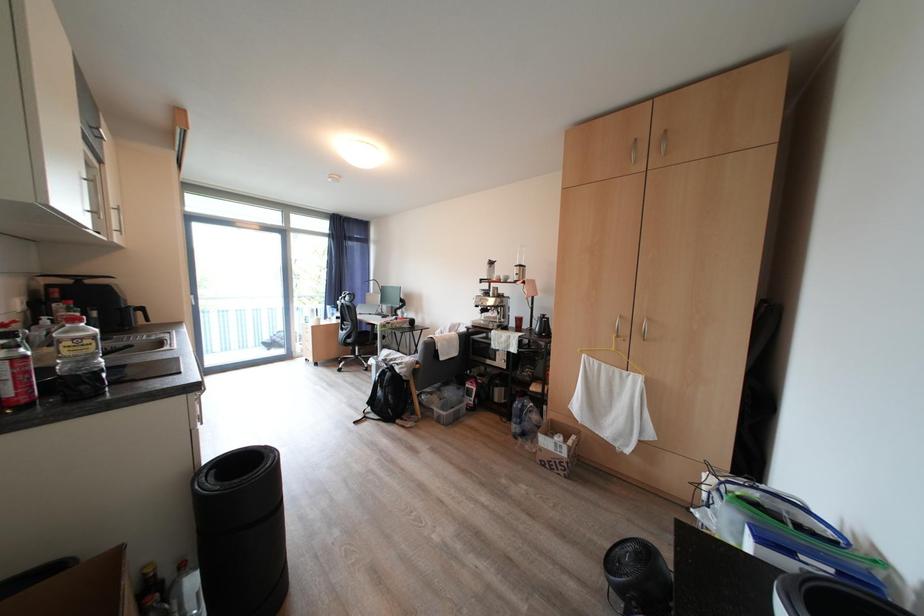
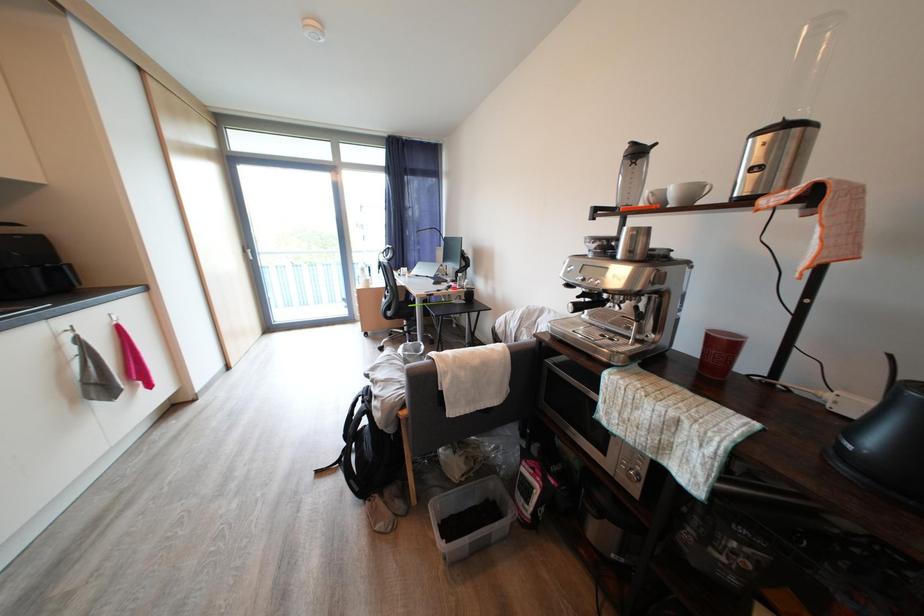
Question: Which direction would the cameraman need to move to produce the second image? Reply with the corresponding letter.

Choices:
 (A) Left
 (B) Right
 (C) Forward
 (D) Backward

Answer: (C)